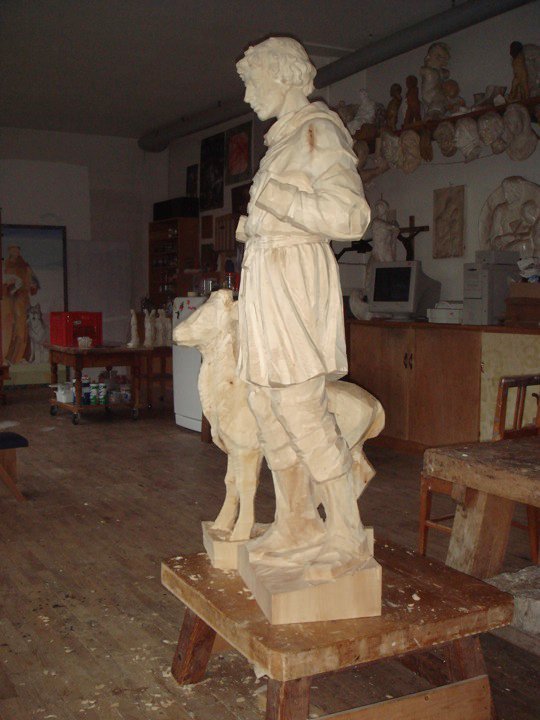
Identify the location of floor. (135, 492).